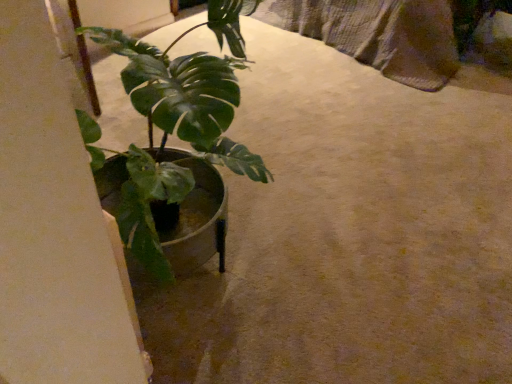
This screenshot has width=512, height=384. What are the coordinates of `green matte plant pot at left` in the screenshot? It's located at (353, 233).

Describe the element at coordinates (353, 233) in the screenshot. I see `green matte plant pot at left` at that location.

At what (x,y) coordinates should I click in order to perform the action: click on green matte plant pot at left. Please return your answer as a coordinate pair (x, y). Image resolution: width=512 pixels, height=384 pixels. Looking at the image, I should click on (353, 233).